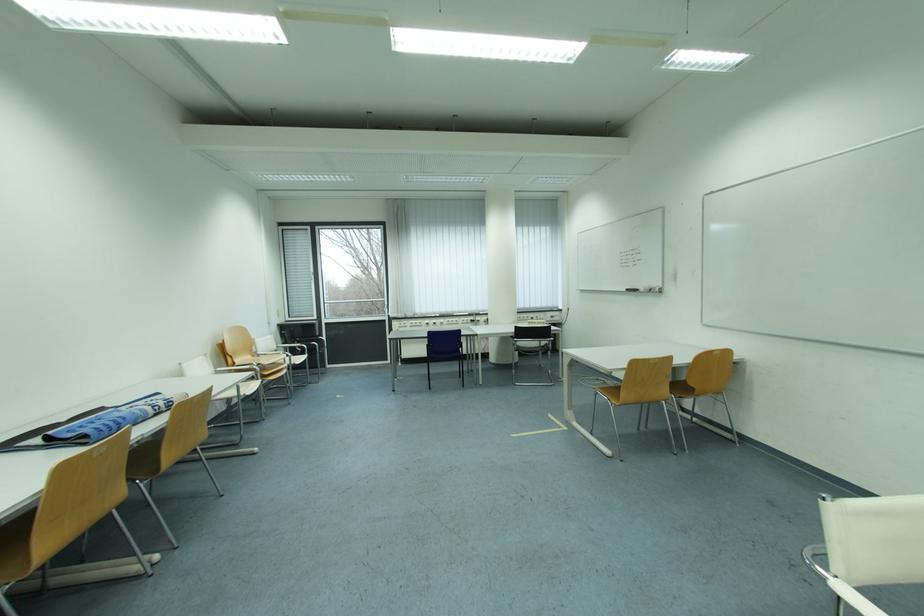
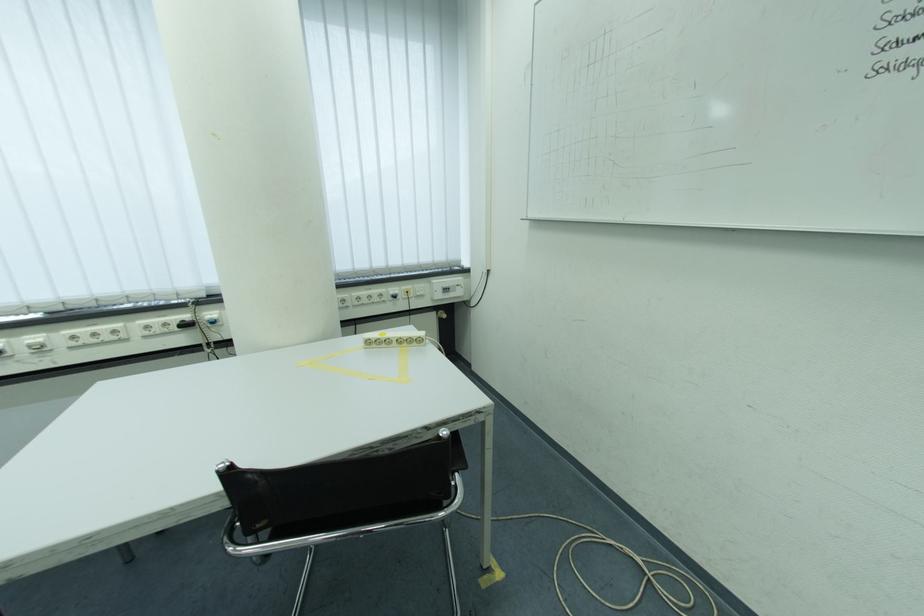
In the second image, find the point that corresponds to pixel 476 323 in the first image.

(175, 326)